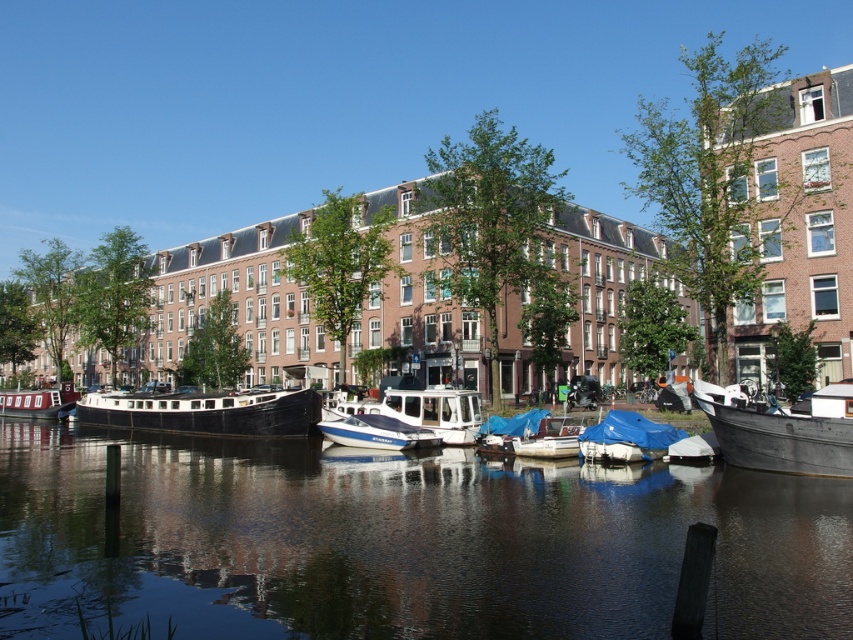
From the picture: Between white glossy boat at center and matte black boat at left, which one is positioned lower?

Positioned lower is matte black boat at left.

Describe the element at coordinates (422, 412) in the screenshot. I see `white glossy boat at center` at that location.

You are a GUI agent. You are given a task and a screenshot of the screen. Output one action in this format:
    pyautogui.click(x=<x>, y=<y>)
    Task: Click on the white glossy boat at center
    This screenshot has height=640, width=853.
    Given the screenshot: What is the action you would take?
    pyautogui.click(x=422, y=412)

Which is more to the right, rusty metal boat at right or blue tarpaulin boat at center?

rusty metal boat at right is more to the right.

Is rusty metal boat at right wider than blue tarpaulin boat at center?

Yes.

Which is behind, point (833, 461) or point (613, 420)?

The point (613, 420) is more distant.

This screenshot has height=640, width=853. What are the coordinates of `rusty metal boat at right` in the screenshot? It's located at (781, 429).

This screenshot has height=640, width=853. I want to click on smooth dark water at center, so click(x=405, y=544).

Measure the distance between smooth dark water at center and camera.

smooth dark water at center and camera are 40.65 meters apart from each other.

Where is `smooth dark water at center`? The image size is (853, 640). smooth dark water at center is located at coordinates (405, 544).

Locate an element on the screen. The width and height of the screenshot is (853, 640). smooth dark water at center is located at coordinates (405, 544).